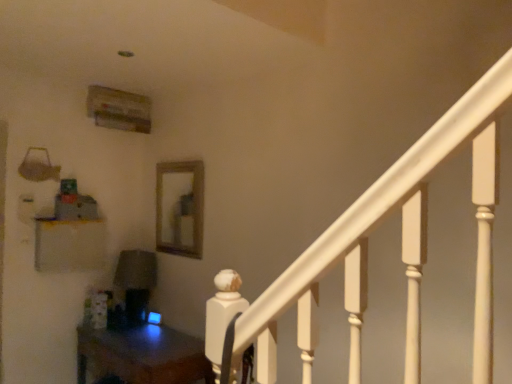
Question: From a real-world perspective, is wooden frame mirror at center under matte white shelf at left?

Choices:
 (A) yes
 (B) no

Answer: (B)

Question: Could you tell me if wooden frame mirror at center is facing matte white shelf at left?

Choices:
 (A) no
 (B) yes

Answer: (B)

Question: Does wooden frame mirror at center have a larger size compared to matte white shelf at left?

Choices:
 (A) no
 (B) yes

Answer: (B)

Question: Is wooden frame mirror at center to the left of matte white shelf at left from the viewer's perspective?

Choices:
 (A) no
 (B) yes

Answer: (A)

Question: Is wooden frame mirror at center thinner than matte white shelf at left?

Choices:
 (A) no
 (B) yes

Answer: (B)

Question: Can you confirm if wooden frame mirror at center is smaller than matte white shelf at left?

Choices:
 (A) no
 (B) yes

Answer: (A)

Question: Are wooden table at lower left and matte white shelf at left located far from each other?

Choices:
 (A) yes
 (B) no

Answer: (B)

Question: Does wooden table at lower left come behind matte white shelf at left?

Choices:
 (A) yes
 (B) no

Answer: (B)

Question: From the image's perspective, is wooden table at lower left above matte white shelf at left?

Choices:
 (A) no
 (B) yes

Answer: (A)

Question: Is wooden table at lower left closer to the viewer compared to matte white shelf at left?

Choices:
 (A) yes
 (B) no

Answer: (A)

Question: Could you tell me if wooden table at lower left is turned towards matte white shelf at left?

Choices:
 (A) yes
 (B) no

Answer: (B)

Question: From the image's perspective, is wooden table at lower left under matte white shelf at left?

Choices:
 (A) no
 (B) yes

Answer: (B)

Question: Considering the relative sizes of wooden frame mirror at center and wooden table at lower left in the image provided, is wooden frame mirror at center thinner than wooden table at lower left?

Choices:
 (A) no
 (B) yes

Answer: (B)